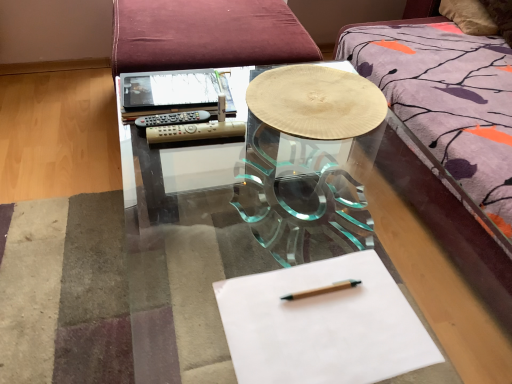
This screenshot has width=512, height=384. I want to click on empty space that is ontop of white paper at center (from a real-world perspective), so click(x=321, y=314).